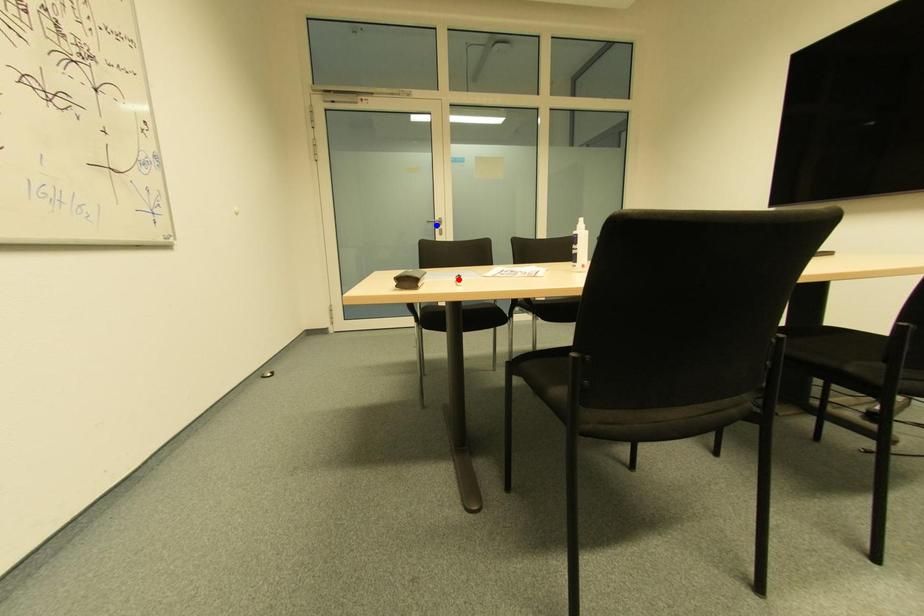
Question: In the image, two points are highlighted. Which point is nearer to the camera? Reply with the corresponding letter.

Choices:
 (A) blue point
 (B) red point

Answer: (B)